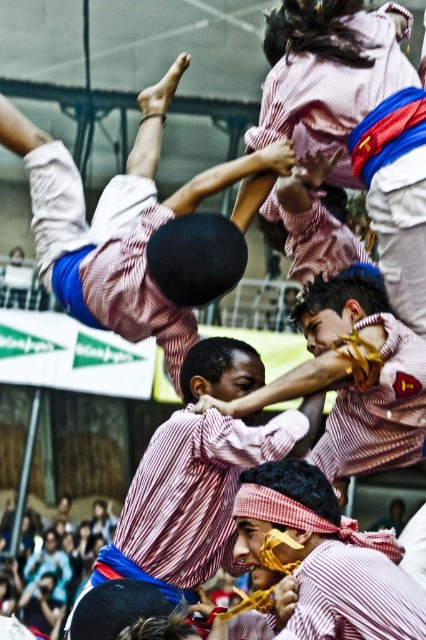
Question: Is striped fabric man at center to the right of striped fabric headband at center from the viewer's perspective?

Choices:
 (A) yes
 (B) no

Answer: (A)

Question: Among these points, which one is farthest from the camera?

Choices:
 (A) [213, 518]
 (B) [146, 145]
 (C) [405, 419]

Answer: (B)

Question: Is striped fabric shirt at center to the right of striped fabric headband at center from the viewer's perspective?

Choices:
 (A) no
 (B) yes

Answer: (A)

Question: Which object is closer to the camera taking this photo?

Choices:
 (A) striped fabric man at center
 (B) striped fabric headband at center

Answer: (B)

Question: Is matte black ball at upper center below striped fabric shirt at center?

Choices:
 (A) no
 (B) yes

Answer: (A)

Question: Estimate the real-world distances between objects in this image. Which object is closer to the matte black ball at upper center?

Choices:
 (A) striped fabric dancer at upper center
 (B) striped fabric headband at center
 (C) striped fabric man at center

Answer: (A)